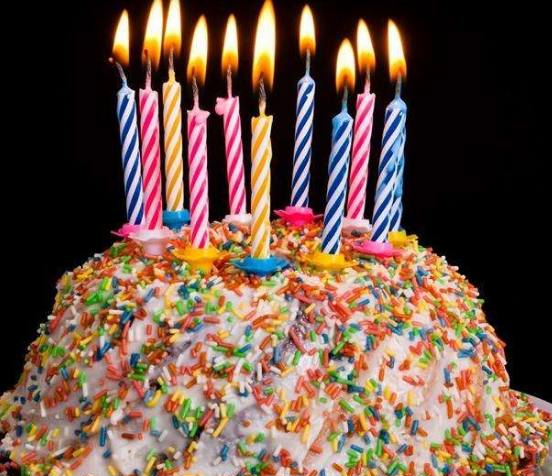
Image resolution: width=552 pixels, height=476 pixels. I want to click on candle wicks, so click(120, 67), click(146, 65), click(171, 59), click(195, 87), click(228, 79), click(261, 89), click(309, 57), click(344, 95), click(366, 72), click(397, 80).